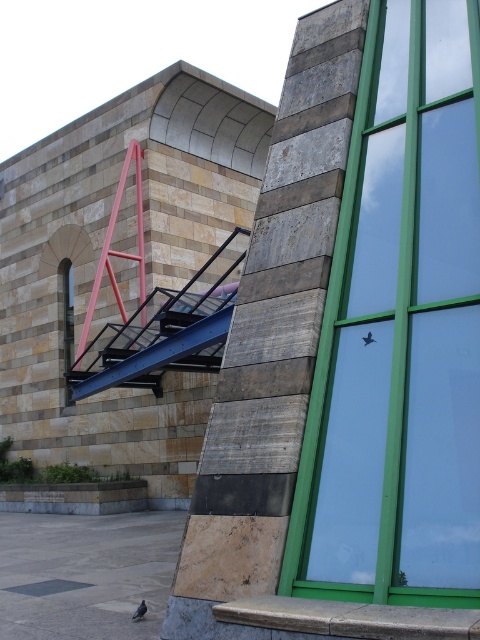
Consider the image. You are standing in front of the building and want to enter through the green glass window at center. To do so, do you need to climb up or go around the blue metallic stair at center?

The green glass window at center is in front of the blue metallic stair at center, so you don not need to climb up the stair. You can go straight to the window.